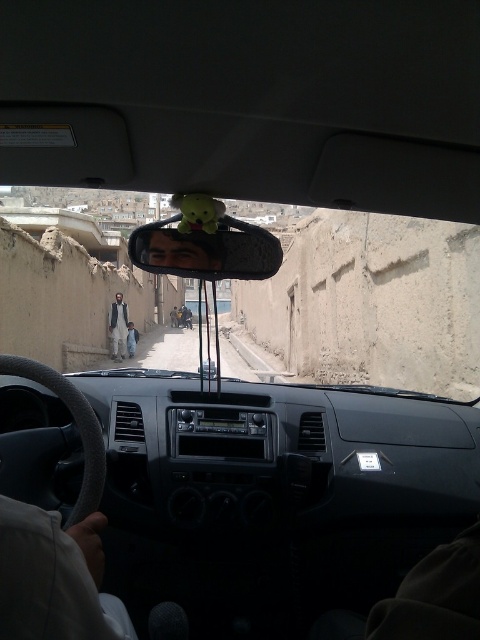
You are a delivery driver who needs to ensure that the items on the dashboard are within the required size limits. The rules state that no object on the dashboard can exceed 15 cm in width. You see the matte plastic mirror at center and the light brown textured jacket at center. Which object is more likely to violate the size limit?

The matte plastic mirror at center has a larger width than the light brown textured jacket at center, so it is more likely to violate the size limit since its width exceeds 15 cm.

You are a passenger in the vehicle and want to adjust the matte plastic mirror at center so you can see the light brown fabric jacket at left better. Is the mirror positioned in a way that allows you to see the jacket?

The matte plastic mirror at center is in front of the light brown fabric jacket at left, so adjusting it should allow you to see the jacket as it is positioned directly in front of the jacket.